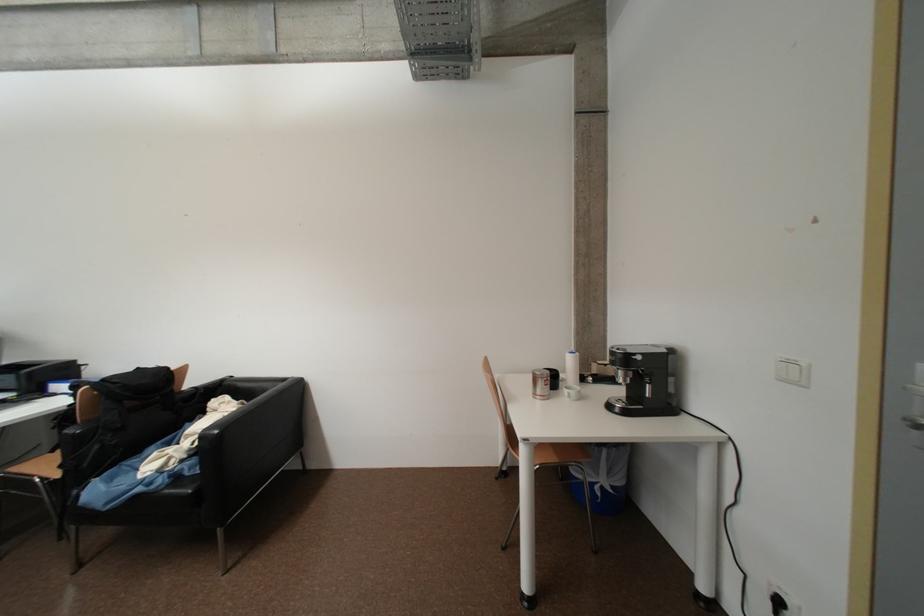
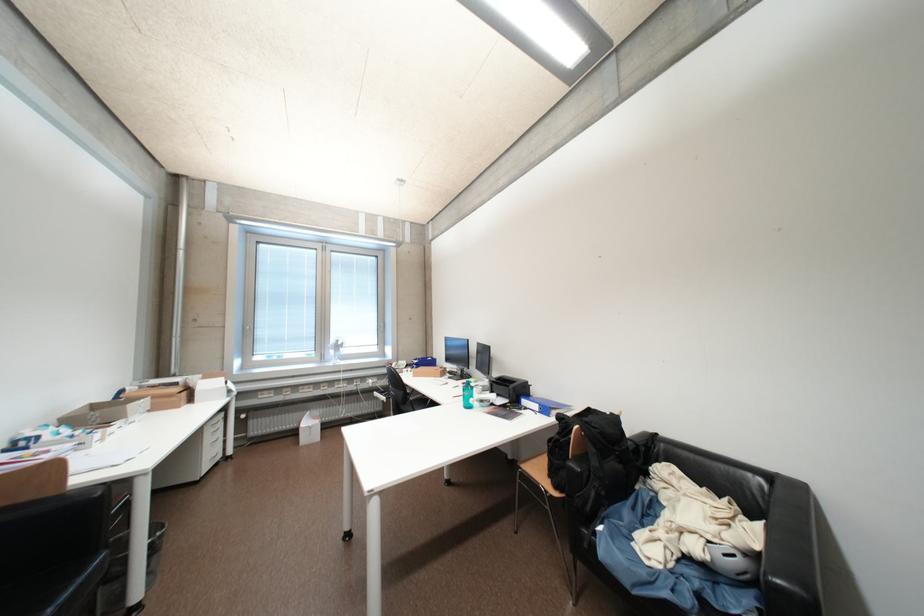
Find the pixel in the second image that matches [70,469] in the first image.

(564, 488)